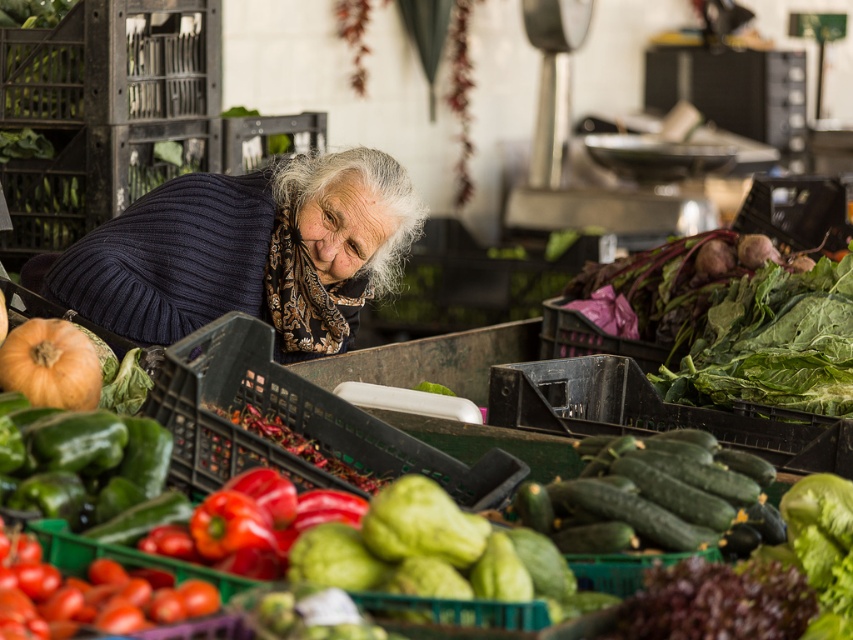
Question: Is green leafy at center positioned before orange matte pumpkin at lower left?

Choices:
 (A) yes
 (B) no

Answer: (B)

Question: Which object is closer to the camera taking this photo?

Choices:
 (A) green leafy at center
 (B) orange matte pumpkin at lower left

Answer: (B)

Question: Does knitted dark blue sweater at center have a lesser width compared to orange matte pumpkin at lower left?

Choices:
 (A) yes
 (B) no

Answer: (B)

Question: Which of the following is the farthest from the observer?

Choices:
 (A) orange matte pumpkin at lower left
 (B) green leafy at center
 (C) knitted dark blue sweater at center

Answer: (C)

Question: Is knitted dark blue sweater at center positioned behind green leafy at center?

Choices:
 (A) no
 (B) yes

Answer: (B)

Question: Considering the real-world distances, which object is farthest from the orange matte pumpkin at lower left?

Choices:
 (A) green leafy at center
 (B) knitted dark blue sweater at center

Answer: (A)